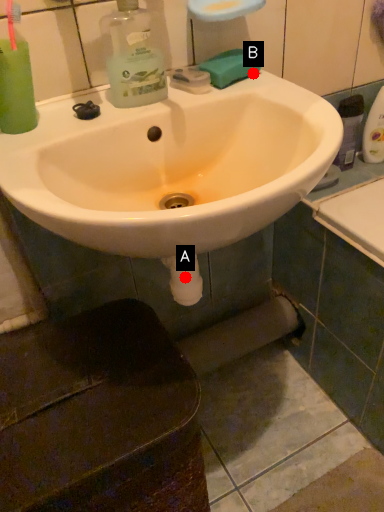
Question: Two points are circled on the image, labeled by A and B beside each circle. Which of the following is the farthest from the observer?

Choices:
 (A) A is further
 (B) B is further

Answer: (A)